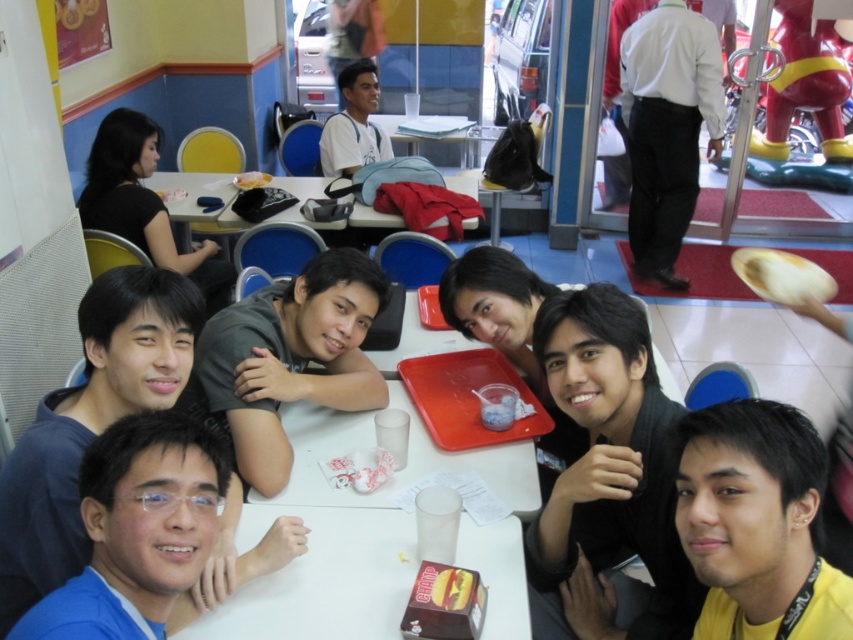
You are a photographer trying to arrange two shirts for a photo shoot. The black matte shirt at center and the blue matte shirt at center are available. If you want to place the thinner one on the left, which shirt should you choose?

The black matte shirt at center is thinner than the blue matte shirt at center, so you should choose the black matte shirt at center to place on the left.

From the picture: You are a photographer trying to capture a clear shot of the black matte shirt at center and the blue matte shirt at center. Which shirt should you focus on first if you want to ensure both are in focus without moving the camera?

The black matte shirt at center is positioned under the blue matte shirt at center, so focusing on the blue matte shirt at center first would help ensure both are in focus since it is closer to the camera.

You are a customer in a fast food restaurant and you want to place your phone on the white plastic table at lower center. However, you notice the black matte shirt at upper left is in the way. Can you still place your phone there?

The white plastic table at lower center is below the black matte shirt at upper left, meaning the shirt is above the table. Since the shirt is not on the table itself, you can still place your phone on the white plastic table at lower center.